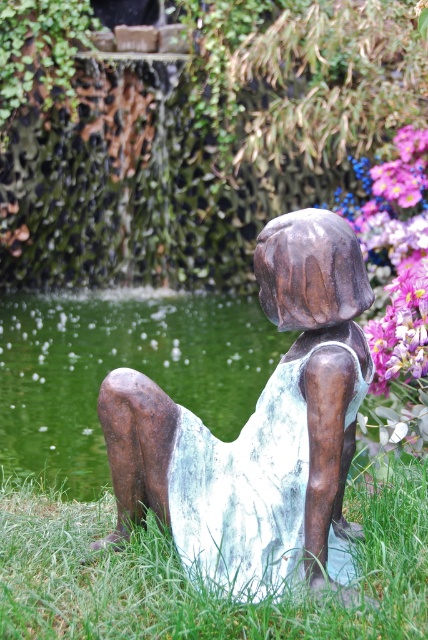
Question: Which object is farther from the camera taking this photo?

Choices:
 (A) green metallic water at lower left
 (B) bronze statue at center
 (C) green grass at lower center

Answer: (A)

Question: Does bronze statue at center lie behind green metallic water at lower left?

Choices:
 (A) yes
 (B) no

Answer: (B)

Question: Is bronze statue at center to the right of green grass at lower center from the viewer's perspective?

Choices:
 (A) no
 (B) yes

Answer: (B)

Question: Does bronze statue at center appear over green metallic water at lower left?

Choices:
 (A) no
 (B) yes

Answer: (A)

Question: Among these points, which one is nearest to the camera?

Choices:
 (A) (35, 316)
 (B) (314, 342)
 (C) (386, 602)

Answer: (C)

Question: Which of the following is the farthest from the observer?

Choices:
 (A) green grass at lower center
 (B) bronze statue at center

Answer: (B)